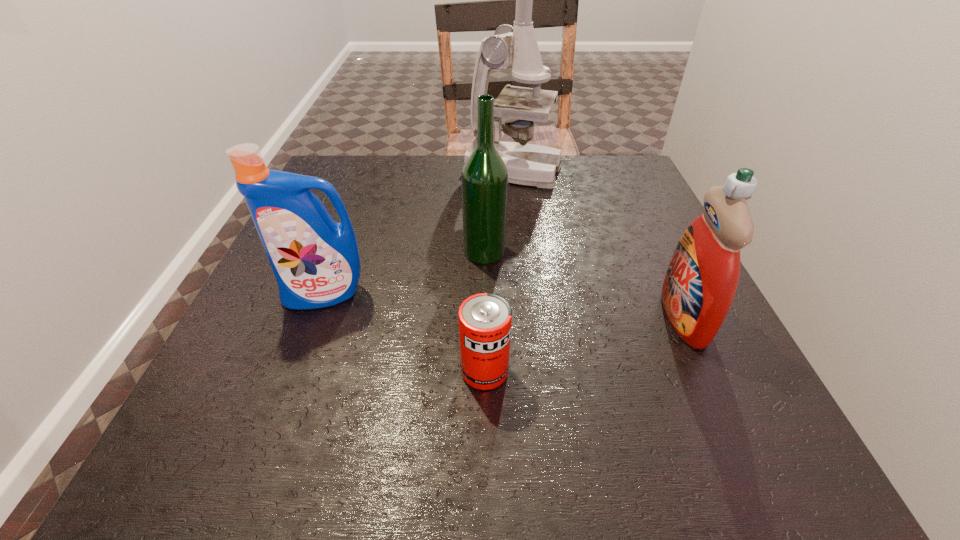
This screenshot has height=540, width=960. I want to click on object identified as the second closest to the fourth nearest object, so click(x=515, y=47).

Where is `vacant point that satisfies the following two spatial constraints: 1. on the label of the can; 2. on the left side of the leftmost object`? This screenshot has width=960, height=540. vacant point that satisfies the following two spatial constraints: 1. on the label of the can; 2. on the left side of the leftmost object is located at coordinates (297, 372).

Where is `free location that satisfies the following two spatial constraints: 1. on the label of the left detergent; 2. on the right side of the shortest object`? The width and height of the screenshot is (960, 540). free location that satisfies the following two spatial constraints: 1. on the label of the left detergent; 2. on the right side of the shortest object is located at coordinates (297, 372).

Find the location of a particular element. This screenshot has width=960, height=540. free space that satisfies the following two spatial constraints: 1. on the label of the shortest object; 2. on the left side of the leftmost object is located at coordinates (297, 372).

Where is `free location that satisfies the following two spatial constraints: 1. on the front surface of the right detergent; 2. on the front side of the shortest object`? This screenshot has height=540, width=960. free location that satisfies the following two spatial constraints: 1. on the front surface of the right detergent; 2. on the front side of the shortest object is located at coordinates coord(709,372).